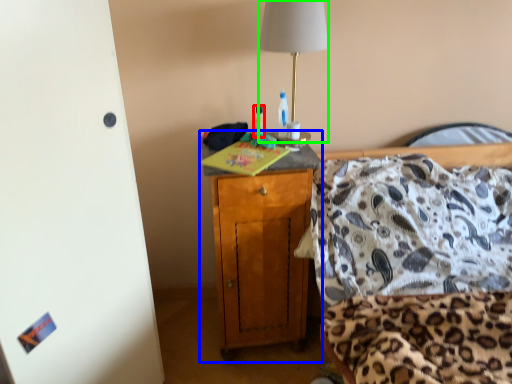
Question: Which object is positioned closest to bottle (highlighted by a red box)? Select from cabinetry (highlighted by a blue box) and lamp (highlighted by a green box).

Choices:
 (A) cabinetry
 (B) lamp

Answer: (B)